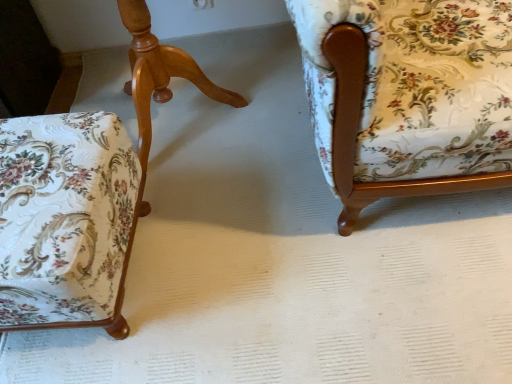
Question: From a real-world perspective, does floral fabric chair at left, arranged as the 2th chair when viewed from the left, stand above floral fabric ottoman at lower left, the third chair viewed from the right?

Choices:
 (A) no
 (B) yes

Answer: (B)

Question: Could you tell me if floral fabric chair at left, the 2th chair viewed from the right, is facing floral fabric ottoman at lower left, the third chair viewed from the right?

Choices:
 (A) yes
 (B) no

Answer: (A)

Question: Is the depth of floral fabric chair at left, arranged as the 2th chair when viewed from the left, greater than that of floral fabric ottoman at lower left, the third chair viewed from the right?

Choices:
 (A) no
 (B) yes

Answer: (B)

Question: Does floral fabric chair at left, arranged as the 2th chair when viewed from the left, appear on the right side of floral fabric ottoman at lower left, arranged as the first chair when viewed from the left?

Choices:
 (A) yes
 (B) no

Answer: (A)

Question: Considering the relative sizes of floral fabric chair at left, the 2th chair viewed from the right, and floral fabric ottoman at lower left, arranged as the first chair when viewed from the left, in the image provided, is floral fabric chair at left, the 2th chair viewed from the right, shorter than floral fabric ottoman at lower left, arranged as the first chair when viewed from the left,?

Choices:
 (A) yes
 (B) no

Answer: (B)

Question: Considering the positions of floral fabric ottoman at lower left, the third chair viewed from the right, and floral fabric chair at right, placed as the third chair when sorted from left to right, in the image, is floral fabric ottoman at lower left, the third chair viewed from the right, bigger or smaller than floral fabric chair at right, placed as the third chair when sorted from left to right,?

Choices:
 (A) small
 (B) big

Answer: (A)

Question: Looking at their shapes, would you say floral fabric ottoman at lower left, the third chair viewed from the right, is wider or thinner than floral fabric chair at right, which is the 1th chair in right-to-left order?

Choices:
 (A) thin
 (B) wide

Answer: (A)

Question: Would you say floral fabric ottoman at lower left, the third chair viewed from the right, is to the left or to the right of floral fabric chair at right, which is the 1th chair in right-to-left order, in the picture?

Choices:
 (A) left
 (B) right

Answer: (A)

Question: Is floral fabric ottoman at lower left, arranged as the first chair when viewed from the left, taller or shorter than floral fabric chair at right, which is the 1th chair in right-to-left order?

Choices:
 (A) tall
 (B) short

Answer: (B)

Question: Is floral fabric chair at right, placed as the third chair when sorted from left to right, in front of or behind floral fabric ottoman at lower left, arranged as the first chair when viewed from the left, in the image?

Choices:
 (A) front
 (B) behind

Answer: (A)

Question: Based on their positions, is floral fabric chair at right, which is the 1th chair in right-to-left order, located to the left or right of floral fabric ottoman at lower left, the third chair viewed from the right?

Choices:
 (A) right
 (B) left

Answer: (A)

Question: Is point (481, 162) closer or farther from the camera than point (103, 226)?

Choices:
 (A) farther
 (B) closer

Answer: (A)

Question: Choose the correct answer: Is floral fabric chair at right, placed as the third chair when sorted from left to right, inside floral fabric ottoman at lower left, the third chair viewed from the right, or outside it?

Choices:
 (A) inside
 (B) outside

Answer: (B)

Question: From a real-world perspective, is floral fabric chair at right, placed as the third chair when sorted from left to right, positioned above or below floral fabric chair at left, the 2th chair viewed from the right?

Choices:
 (A) above
 (B) below

Answer: (A)

Question: In terms of size, does floral fabric chair at right, which is the 1th chair in right-to-left order, appear bigger or smaller than floral fabric chair at left, arranged as the 2th chair when viewed from the left?

Choices:
 (A) small
 (B) big

Answer: (B)